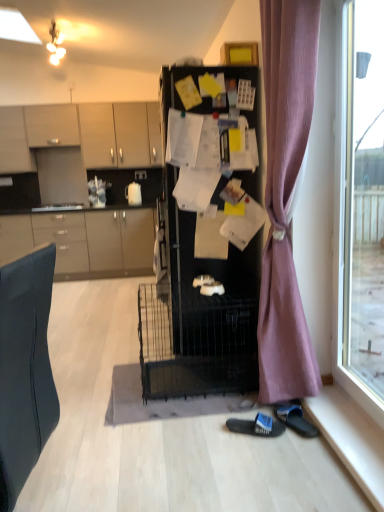
Question: In terms of size, does black rubber slipper at lower right, acting as the first footwear starting from the right, appear bigger or smaller than purple fabric curtain at right?

Choices:
 (A) big
 (B) small

Answer: (B)

Question: Is black rubber slipper at lower right, positioned as the second footwear in left-to-right order, wider or thinner than purple fabric curtain at right?

Choices:
 (A) thin
 (B) wide

Answer: (A)

Question: Estimate the real-world distances between objects in this image. Which object is closer to the purple fabric curtain at right?

Choices:
 (A) white glossy sink at left
 (B) white matte teapot at upper center
 (C) black matte refrigerator at center
 (D) black rubber slipper at lower right, acting as the first footwear starting from the right
 (E) matte gray cabinets at left, acting as the 1th cabinetry starting from the bottom

Answer: (C)

Question: Which object is the farthest from the white matte teapot at upper center?

Choices:
 (A) white glossy sink at left
 (B) purple fabric curtain at right
 (C) matte gray cabinets at left, positioned as the 4th cabinetry in top-to-bottom order
 (D) black rubber slipper at lower right, positioned as the second footwear in left-to-right order
 (E) matte beige cabinets at upper left, which appears as the 3th cabinetry when ordered from the bottom

Answer: (D)